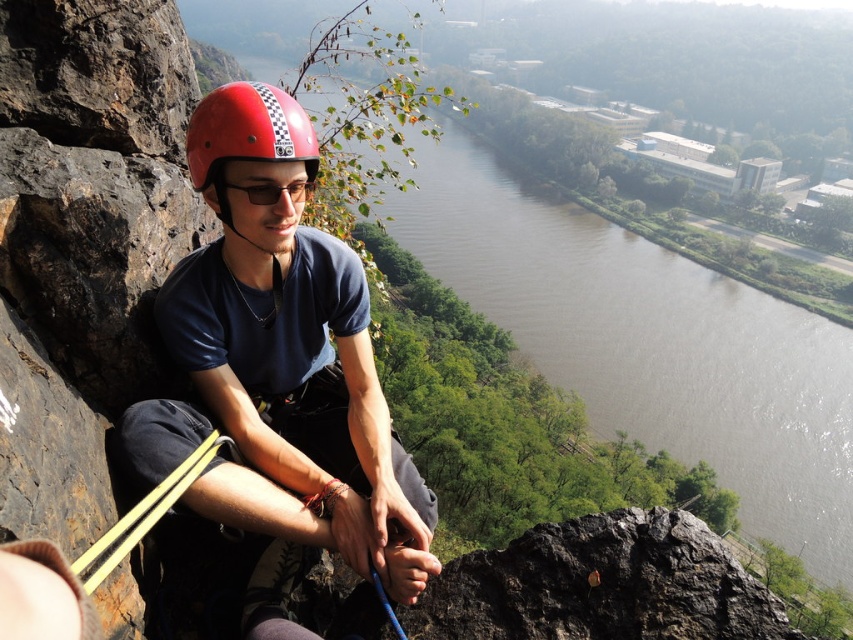
You are a hiker standing at the base of the cliff where the climber is positioned. You want to cross the river shown in the image. The bridge you plan to use is located at the brown water at center. However, the bridge is only 400 feet long. Will the bridge be long enough to span the river at that location?

The distance between the brown water at center and the viewer is 446.47 feet. Since the bridge is only 400 feet long, it will not be long enough to span the river at that location.